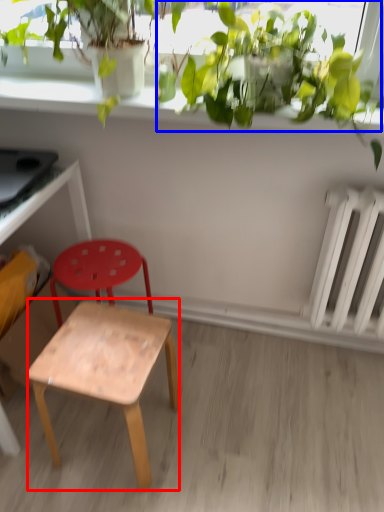
Question: Which of the following is the closest to the observer, stool (highlighted by a red box) or vegetation (highlighted by a blue box)?

Choices:
 (A) stool
 (B) vegetation

Answer: (B)